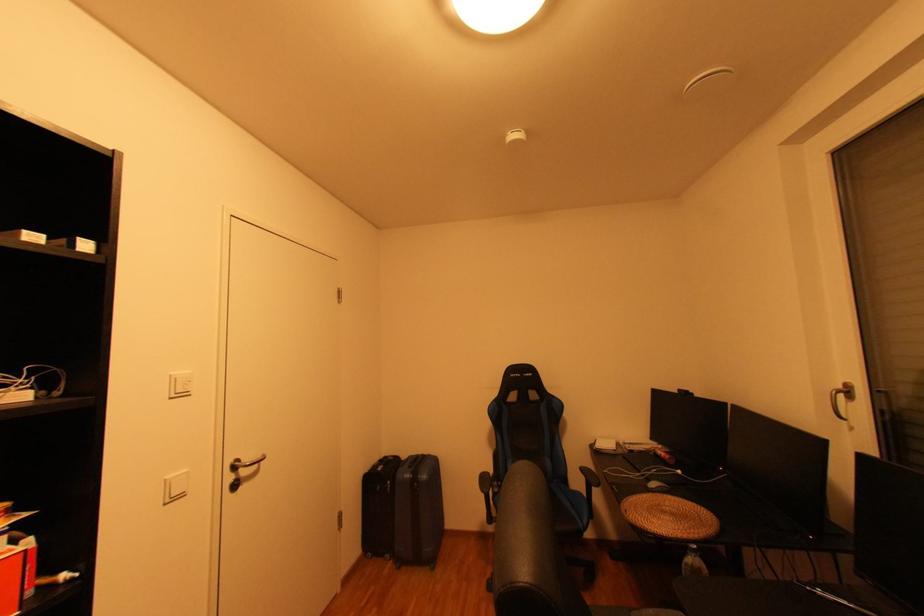
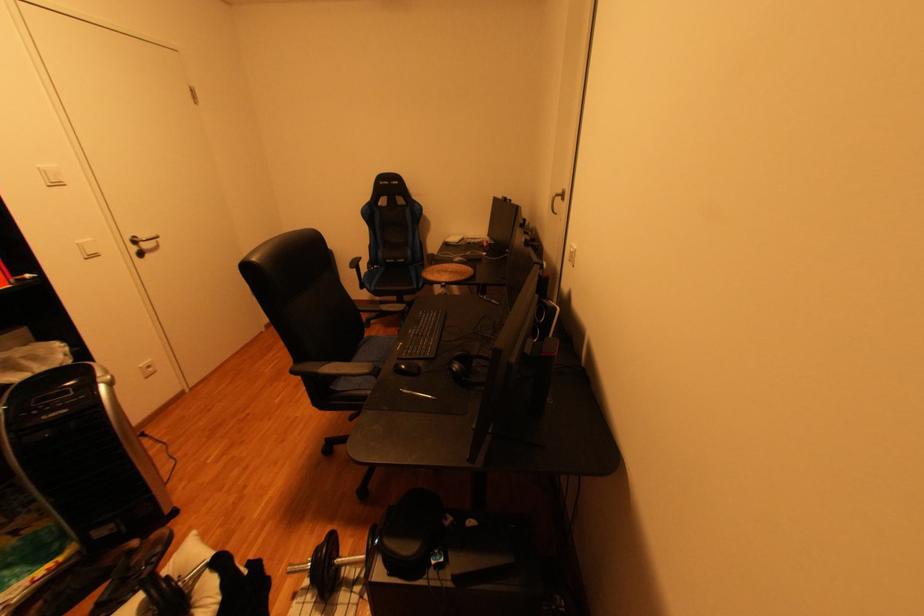
In the second image, find the point that corresponds to point 247,475 in the first image.

(150, 248)